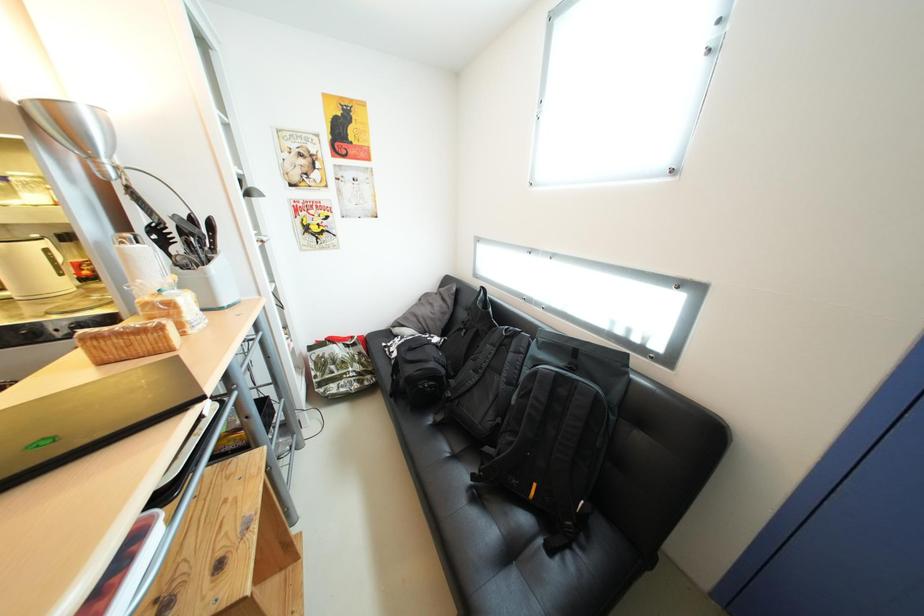
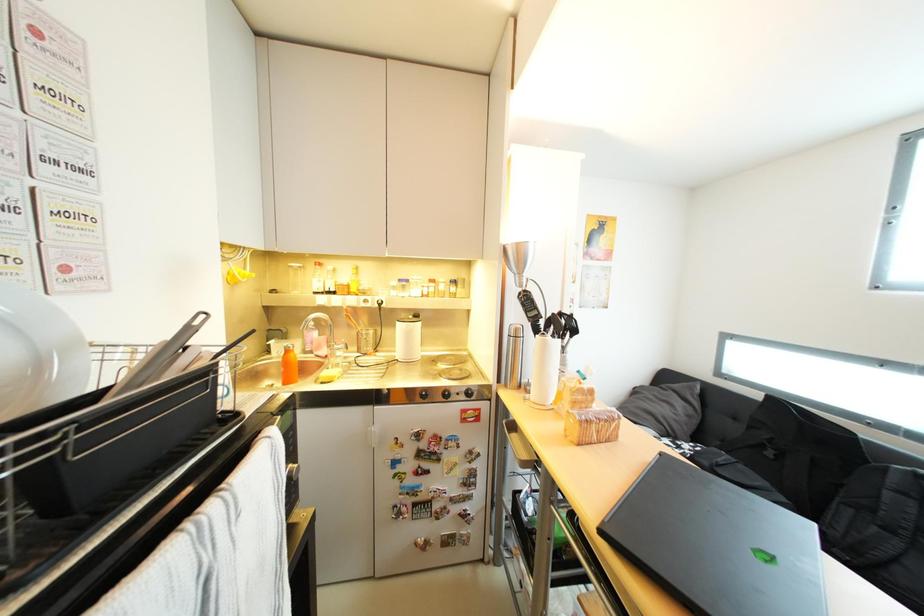
Question: What movement of the cameraman would produce the second image?

Choices:
 (A) Left
 (B) Right
 (C) Forward
 (D) Backward

Answer: (A)